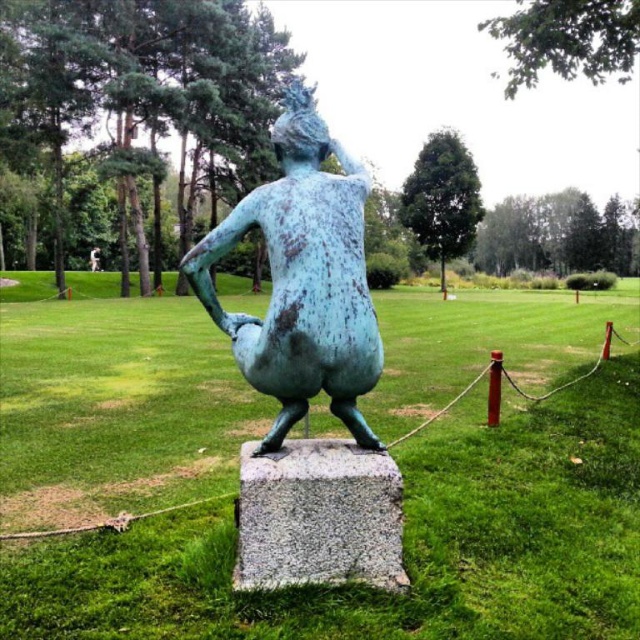
Can you confirm if green patina statue at center is shorter than granite at center?

Yes.

Is point (291, 172) closer to camera compared to point (346, 458)?

That is False.

This screenshot has width=640, height=640. I want to click on green patina statue at center, so click(301, 278).

Can you confirm if green patinated bronze statue at center is bigger than granite at center?

Indeed, green patinated bronze statue at center has a larger size compared to granite at center.

Measure the distance between point (0, 440) and camera.

They are 5.73 meters apart.

Where is `green patinated bronze statue at center`? This screenshot has width=640, height=640. green patinated bronze statue at center is located at coordinates (403, 541).

Locate an element on the screen. green patinated bronze statue at center is located at coordinates (403, 541).

Between green patinated bronze statue at center and green patina statue at center, which one is positioned higher?

green patina statue at center

Can you confirm if green patinated bronze statue at center is thinner than green patina statue at center?

No.

Who is more distant from viewer, (x=593, y=401) or (x=304, y=84)?

Point (x=593, y=401)

At what (x,y) coordinates should I click in order to perform the action: click on green patinated bronze statue at center. Please return your answer as a coordinate pair (x, y). This screenshot has height=640, width=640. Looking at the image, I should click on (403, 541).